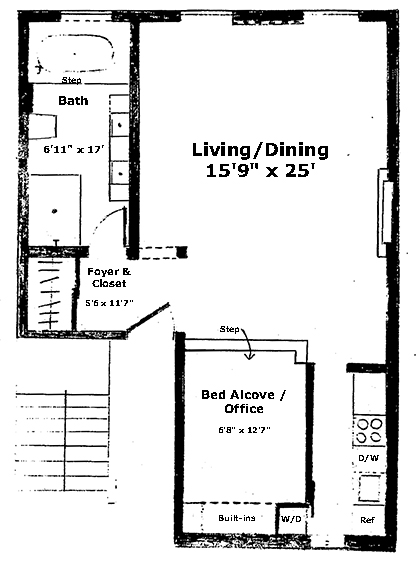
I want to click on artwork, so click(309, 115).